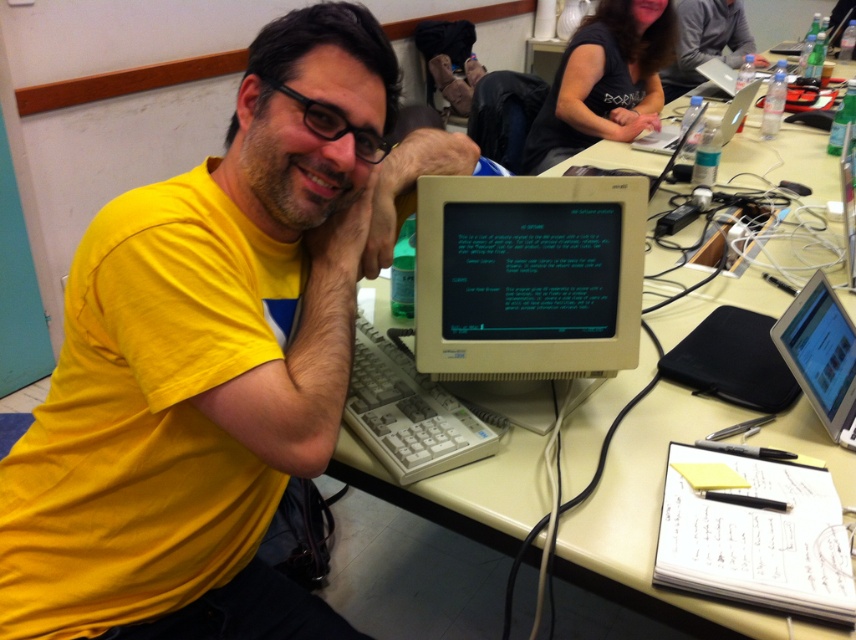
Does beige matte skin at center have a greater width compared to matte gray laptop at upper right?

No, beige matte skin at center is not wider than matte gray laptop at upper right.

Can you confirm if beige matte skin at center is positioned to the left of matte gray laptop at upper right?

Yes, beige matte skin at center is to the left of matte gray laptop at upper right.

Where is `beige matte skin at center`? Image resolution: width=856 pixels, height=640 pixels. beige matte skin at center is located at coordinates (290, 182).

Does point (135, 440) lie behind point (828, 387)?

No, (135, 440) is closer to viewer.

Which is above, yellow matte shirt at center or silver metallic laptop at right?

yellow matte shirt at center is above.

This screenshot has height=640, width=856. What are the coordinates of `yellow matte shirt at center` in the screenshot? It's located at (210, 364).

Find the location of a particular element. yellow matte shirt at center is located at coordinates (210, 364).

Does white plastic monitor at center appear on the left side of beige matte skin at center?

Incorrect, white plastic monitor at center is not on the left side of beige matte skin at center.

How much distance is there between white plastic monitor at center and beige matte skin at center?

The distance of white plastic monitor at center from beige matte skin at center is 11.86 inches.

The height and width of the screenshot is (640, 856). What are the coordinates of `white plastic monitor at center` in the screenshot? It's located at pyautogui.click(x=526, y=285).